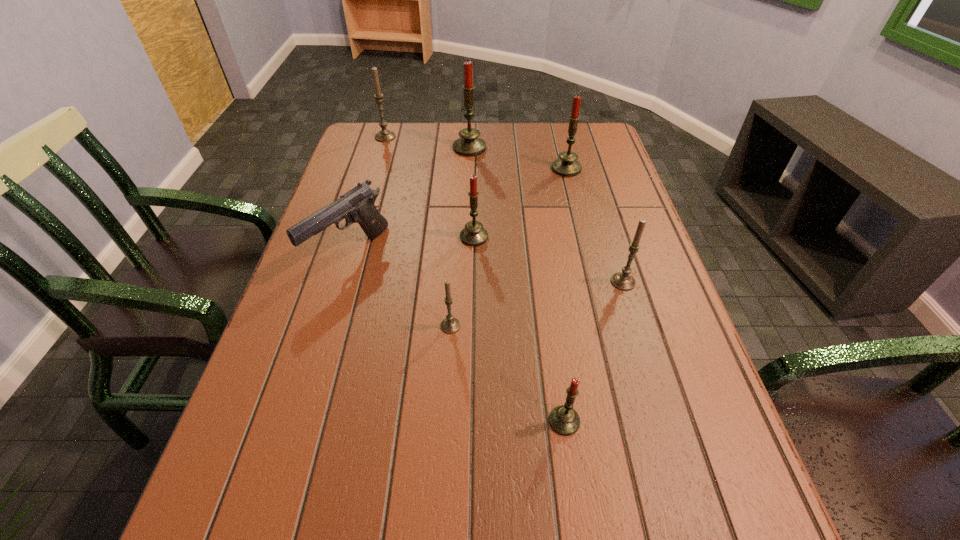
Select which red candle appears as the closest to the third farthest red candle. Please provide its 2D coordinates. Your answer should be formatted as a tuple, i.e. [(x, y)], where the tuple contains the x and y coordinates of a point satisfying the conditions above.

[(567, 166)]

Identify which red candle is located as the third nearest to the black gun. Please provide its 2D coordinates. Your answer should be formatted as a tuple, i.e. [(x, y)], where the tuple contains the x and y coordinates of a point satisfying the conditions above.

[(564, 420)]

Identify the location of the second closest gray candle to the fifth farthest candle. (384, 135).

Locate an element on the screen. gray candle that is the second closest one to the black gun is located at coordinates (384, 135).

The width and height of the screenshot is (960, 540). Find the location of `free location that satisfies the following two spatial constraints: 1. at the muzzle of the gun; 2. on the right side of the second gray candle from right to left`. free location that satisfies the following two spatial constraints: 1. at the muzzle of the gun; 2. on the right side of the second gray candle from right to left is located at coordinates (327, 326).

Where is `vacant space that satisfies the following two spatial constraints: 1. on the back side of the nearest gray candle; 2. on the left side of the second smallest gray candle`? The width and height of the screenshot is (960, 540). vacant space that satisfies the following two spatial constraints: 1. on the back side of the nearest gray candle; 2. on the left side of the second smallest gray candle is located at coordinates (453, 282).